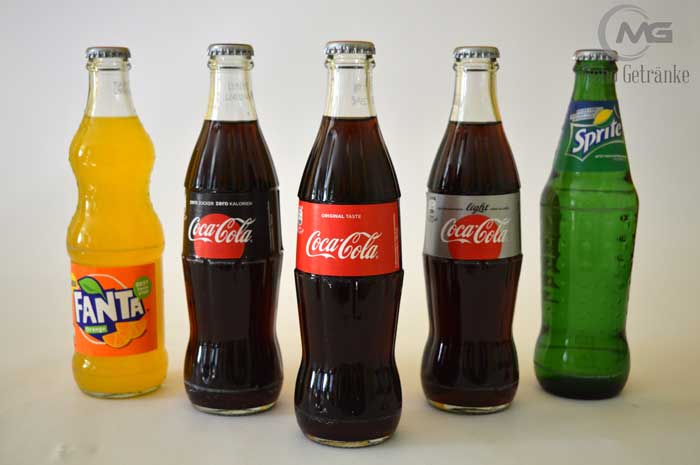
Where is `glass bottles`? glass bottles is located at coordinates (136, 194), (236, 148), (372, 162), (458, 159), (581, 148).